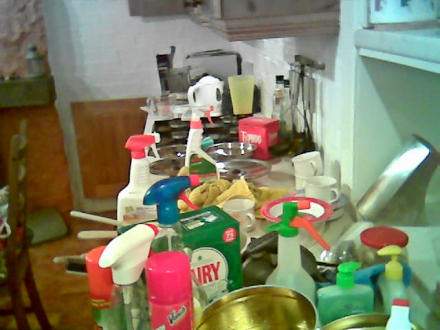
Image resolution: width=440 pixels, height=330 pixels. What are the coordinates of `oven` in the screenshot? It's located at (171, 132).